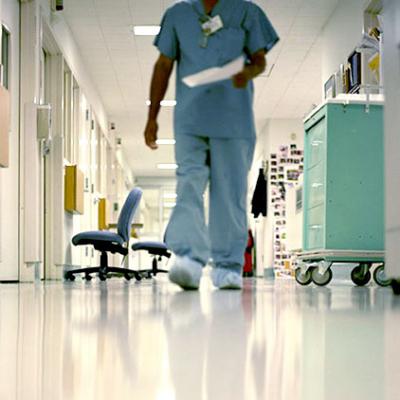
Where is `tiled ceiling empty space`? Image resolution: width=400 pixels, height=400 pixels. tiled ceiling empty space is located at coordinates (144, 160), (120, 100), (102, 30), (313, 17), (288, 97), (139, 63).